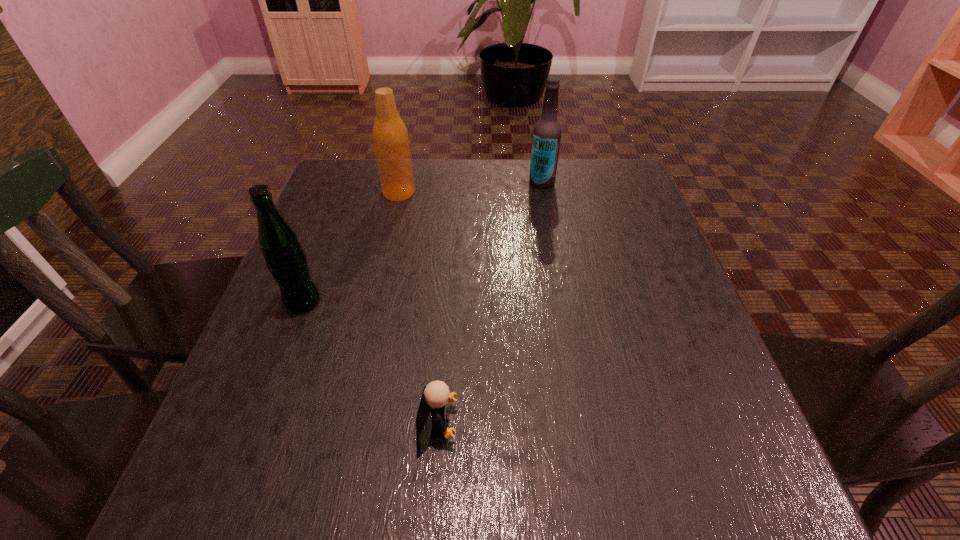
Image resolution: width=960 pixels, height=540 pixels. Identify the location of blank space at the near right corner. (729, 462).

Identify the location of empty location between the leftmost object and the second beer bottle from right to left. (351, 246).

Locate an element on the screen. vacant area that lies between the leftmost object and the second object from left to right is located at coordinates tap(351, 246).

Locate an element on the screen. free space between the rightmost beer bottle and the Lego is located at coordinates (490, 303).

This screenshot has width=960, height=540. Find the location of `unoccupied position between the nearest object and the leftmost object`. unoccupied position between the nearest object and the leftmost object is located at coordinates click(370, 362).

Find the location of a particular element. This screenshot has width=960, height=540. free point between the rightmost beer bottle and the third object from right to left is located at coordinates (470, 187).

The image size is (960, 540). Identify the location of vacant space in between the shortest object and the rightmost beer bottle. (490, 303).

Image resolution: width=960 pixels, height=540 pixels. In order to click on free space between the shortest object and the rightmost beer bottle in this screenshot , I will do `click(490, 303)`.

At what (x,y) coordinates should I click in order to perform the action: click on free space between the leftmost object and the second beer bottle from right to left. Please return your answer as a coordinate pair (x, y). The image size is (960, 540). Looking at the image, I should click on (351, 246).

The height and width of the screenshot is (540, 960). Identify the location of vacant region between the second beer bottle from right to left and the rightmost beer bottle. (470, 187).